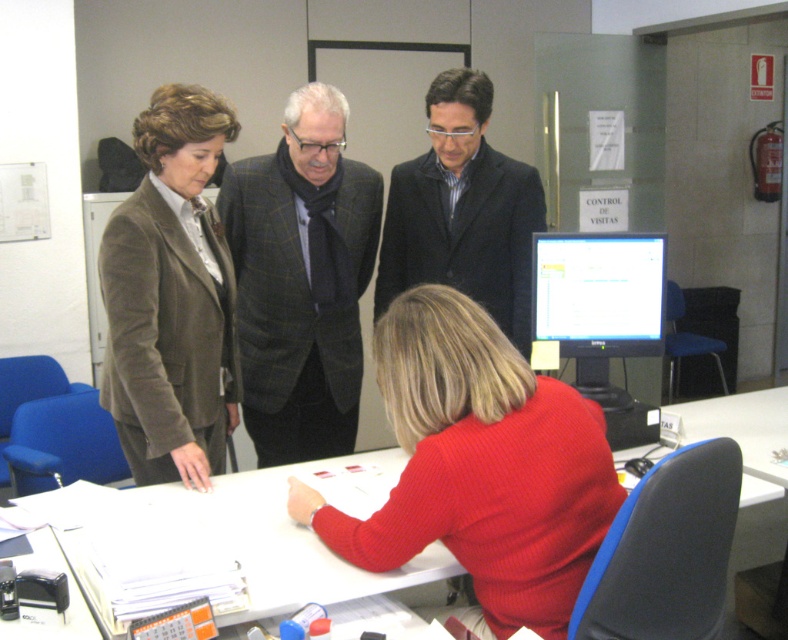
Locate an element on the screen. red sweater at center is located at coordinates (480, 465).

Is red sweater at center positioned at the back of white glossy table at lower center?

Yes, it is behind white glossy table at lower center.

Is point (508, 406) in front of point (716, 435)?

Yes, point (508, 406) is closer to viewer.

Identify the location of red sweater at center. (480, 465).

Who is taller, black woolen suit at center or matte black monitor at center?

Standing taller between the two is black woolen suit at center.

Between black woolen suit at center and matte black monitor at center, which one is positioned higher?

Positioned higher is black woolen suit at center.

Where is `black woolen suit at center`? The image size is (788, 640). black woolen suit at center is located at coordinates (463, 234).

Does plaid wool blazer at center have a greater height compared to matte black monitor at center?

Result: Yes.

Is the position of plaid wool blazer at center less distant than that of matte black monitor at center?

No, it is behind matte black monitor at center.

Where is `plaid wool blazer at center`? The image size is (788, 640). plaid wool blazer at center is located at coordinates (299, 300).